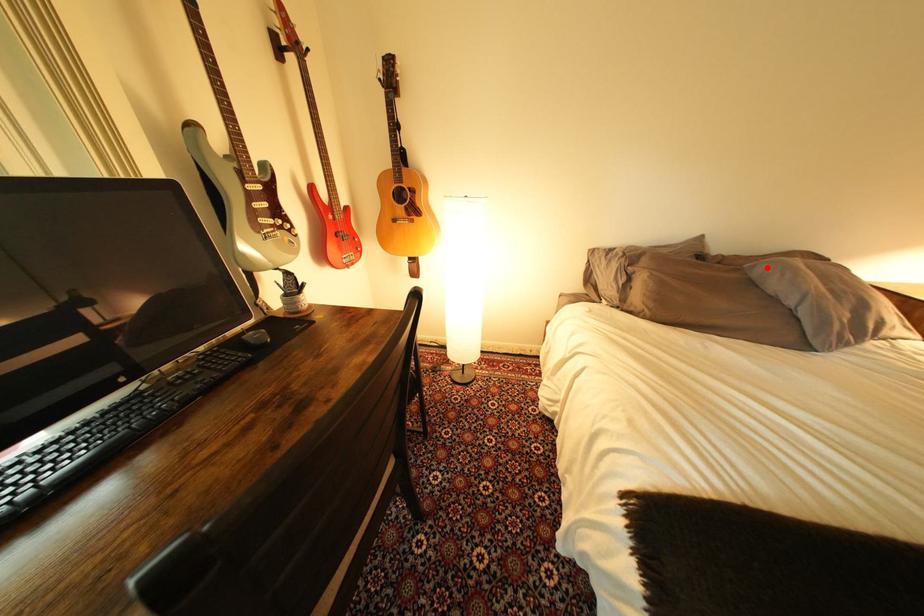
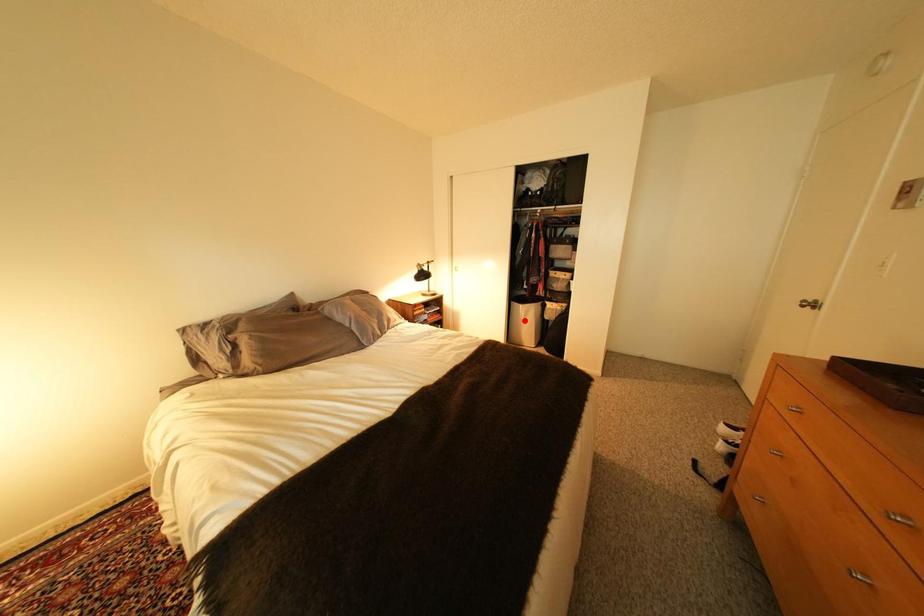
I am providing you with two images of the same scene from different viewpoints. A red point is marked on the first image and another point is marked on the second image. Is the red point in image1 aligned with the point shown in image2?

No